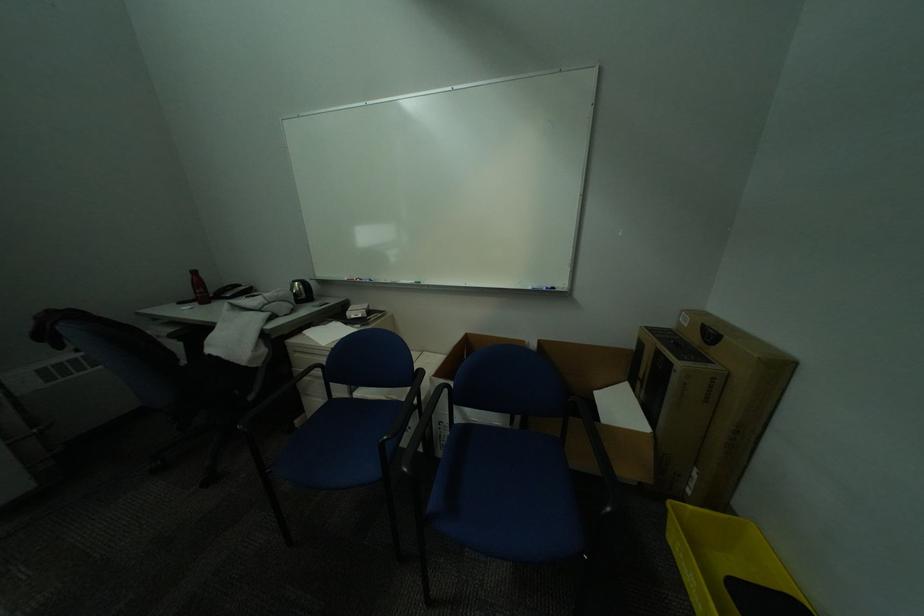
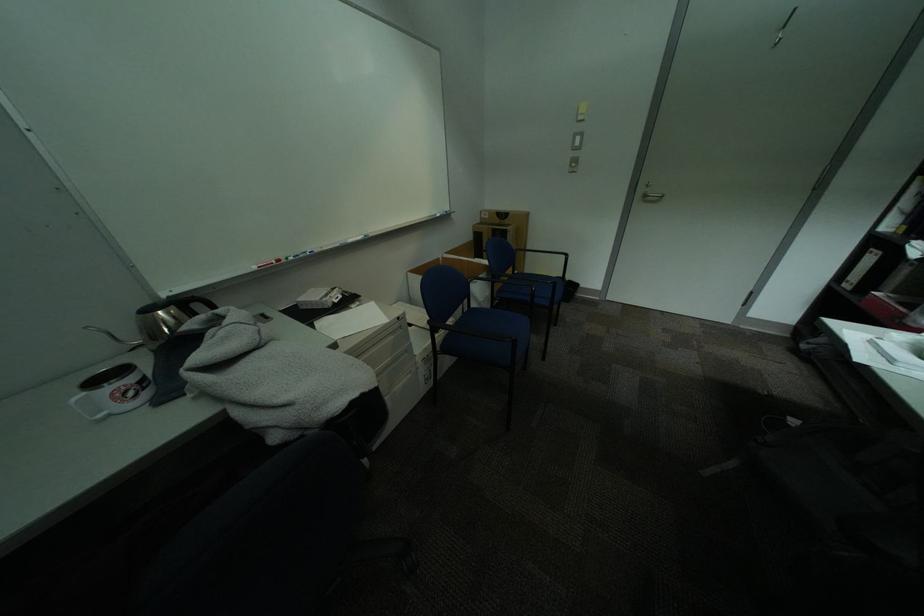
Where in the second image is the point corresponding to the point at 536,342 from the first image?

(450, 259)